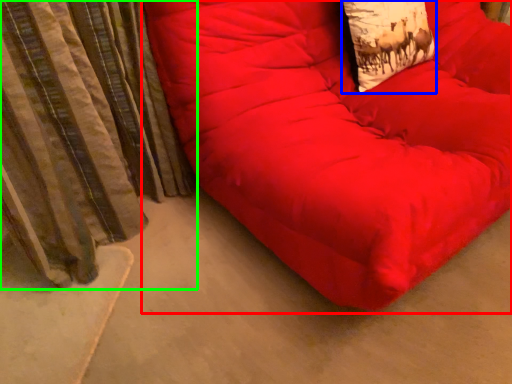
Question: Which is nearer to the furniture (highlighted by a red box)? throw pillow (highlighted by a blue box) or curtain (highlighted by a green box).

Choices:
 (A) throw pillow
 (B) curtain

Answer: (A)